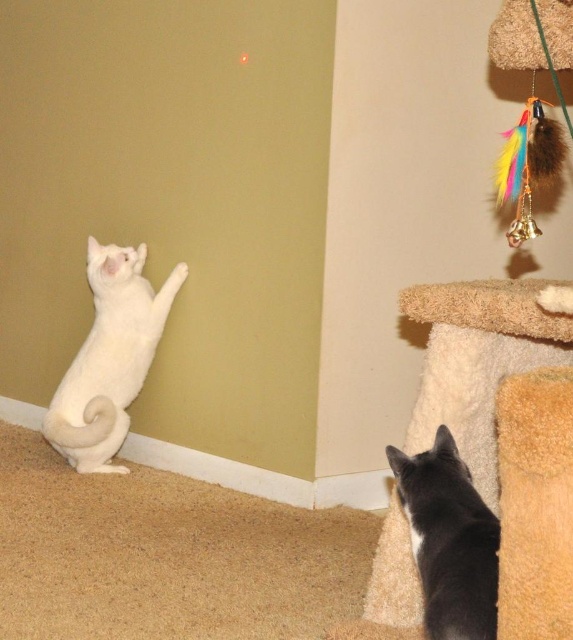
Based on the scene description, where is the white fur cat at left positioned in terms of its 2D coordinates?

The white fur cat at left is positioned at the 2D coordinates of point (x=109, y=356).

You are a cat owner observing the scene. You notice a point marked at coordinates point (109,356). Which cat is this point located on?

The point (109,356) is located on the white fur cat at left.

You are a cat owner who wants to place a cat tree in the room. The cat tree must be tall enough for both cats to climb. Given the height difference between the white fur cat at left and the black fur cat at lower right, what is the minimum height the cat tree should have?

The white fur cat at left is taller than the black fur cat at lower right. To accommodate both cats, the cat tree should be at least as tall as the white fur cat at left to ensure it meets the needs of the taller cat.